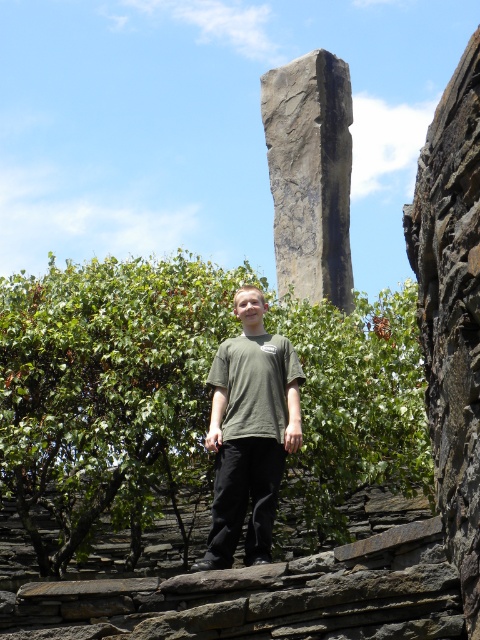
Looking at this image, who is more distant from viewer, (300, 296) or (278, 481)?

Point (300, 296)

Measure the distance between point [343,221] and camera.

Point [343,221] and camera are 95.38 meters apart from each other.

You are a GUI agent. You are given a task and a screenshot of the screen. Output one action in this format:
    pyautogui.click(x=<x>, y=<y>)
    Task: Click on the gray rough stone at center
    The width and height of the screenshot is (480, 640).
    Given the screenshot: What is the action you would take?
    pyautogui.click(x=311, y=173)

Is rusty stone wall at right thinner than gray rough stone at center?

Yes.

Is the position of rusty stone wall at right more distant than that of gray rough stone at center?

No.

Who is more distant from viewer, (462, 102) or (291, 131)?

The point (291, 131) is more distant.

The height and width of the screenshot is (640, 480). Find the location of `rusty stone wall at right`. rusty stone wall at right is located at coordinates (452, 312).

Can you confirm if rusty stone wall at right is shorter than green matte shirt at center?

No, rusty stone wall at right is not shorter than green matte shirt at center.

Does rusty stone wall at right have a larger size compared to green matte shirt at center?

Incorrect, rusty stone wall at right is not larger than green matte shirt at center.

Identify the location of rusty stone wall at right. (452, 312).

The image size is (480, 640). Identify the location of rusty stone wall at right. (452, 312).